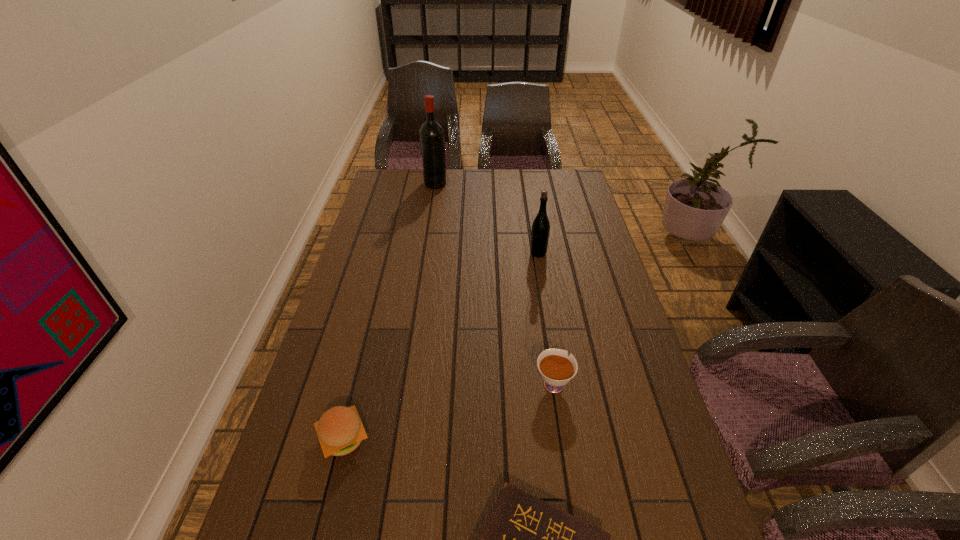
Identify the location of empty location between the second object from left to right and the fourth nearest object. The image size is (960, 540). (487, 218).

This screenshot has height=540, width=960. I want to click on free space between the tallest object and the leftmost object, so click(x=390, y=310).

What are the coordinates of `empty location between the fourth object from right to left and the hamburger` in the screenshot? It's located at (390, 310).

The image size is (960, 540). I want to click on free space between the fourth object from right to left and the leftmost object, so click(x=390, y=310).

Locate an element on the screen. Image resolution: width=960 pixels, height=540 pixels. object that is the third closest to the fourth object from right to left is located at coordinates (340, 431).

Image resolution: width=960 pixels, height=540 pixels. Find the location of `object that is the third closest to the wine bottle`. object that is the third closest to the wine bottle is located at coordinates (340, 431).